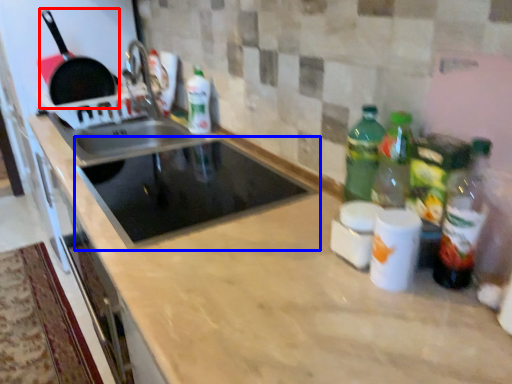
Question: Which of the following is the farthest to the observer, frying pan (highlighted by a red box) or appliance (highlighted by a blue box)?

Choices:
 (A) frying pan
 (B) appliance

Answer: (A)